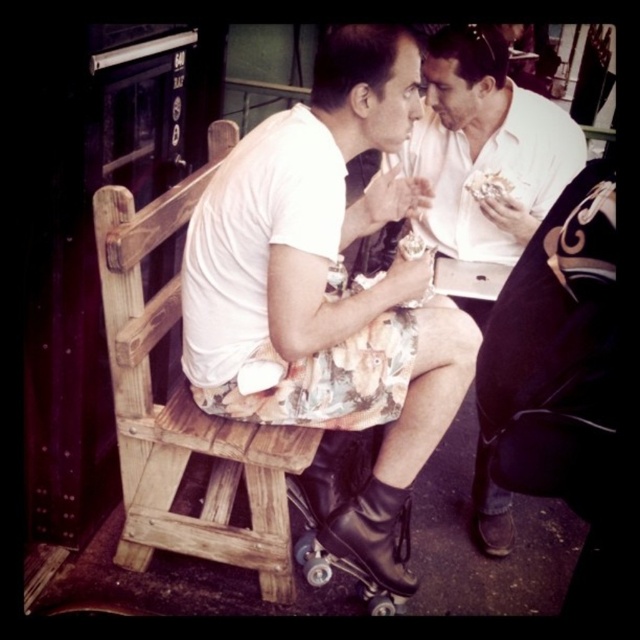
You are a photographer standing 2 meters away from the two people. You want to take a photo of the floral fabric skirt at center. Since the two people are blocking your view, can you move closer to them to capture the skirt without exceeding the maximum safe distance of 1.5 meters between you and them?

The two people are 1.41 meters apart. If you move closer to them so that you are now 1.5 meters away from them, you can take the photo. Since 1.5 meters is the maximum safe distance, moving to that distance is acceptable.

You are standing at the origin point of the image. Which object is closest to the point at coordinates (324, 285)?

The floral fabric skirt at center is located at point (324, 285).

You are a delivery robot with a 50 cm wide package. You need to place it between the floral fabric skirt at center and the white creamy ice cream at center. Is there enough space?

The distance between the floral fabric skirt at center and the white creamy ice cream at center is 79.74 centimeters. Since the package is 50 cm wide, there is sufficient space to place it between them.